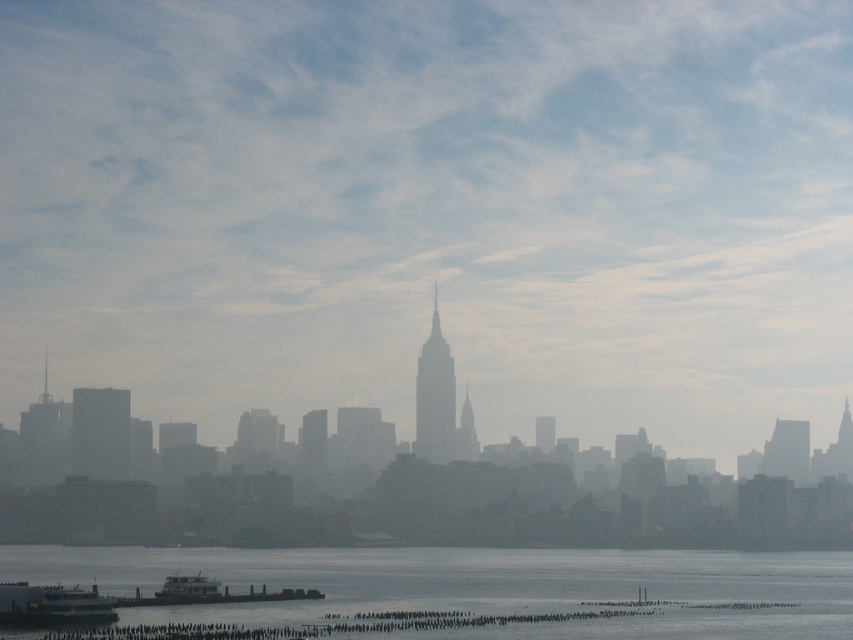
Question: Which point appears closest to the camera in this image?

Choices:
 (A) (207, 588)
 (B) (743, 625)
 (C) (490, 48)

Answer: (C)

Question: Is the position of transparent foggy skyline at center more distant than that of metallic gray ferry at lower center?

Choices:
 (A) yes
 (B) no

Answer: (B)

Question: Is white glossy ferry at lower left wider than metallic gray ferry at lower center?

Choices:
 (A) no
 (B) yes

Answer: (A)

Question: Is transparent foggy skyline at center bigger than white glossy ferry at lower left?

Choices:
 (A) no
 (B) yes

Answer: (B)

Question: Which point is closer to the camera taking this photo?

Choices:
 (A) (86, 621)
 (B) (198, 579)
 (C) (737, 570)
 (D) (294, 296)

Answer: (D)

Question: Which of the following is the farthest from the observer?

Choices:
 (A) (813, 557)
 (B) (264, 600)

Answer: (A)